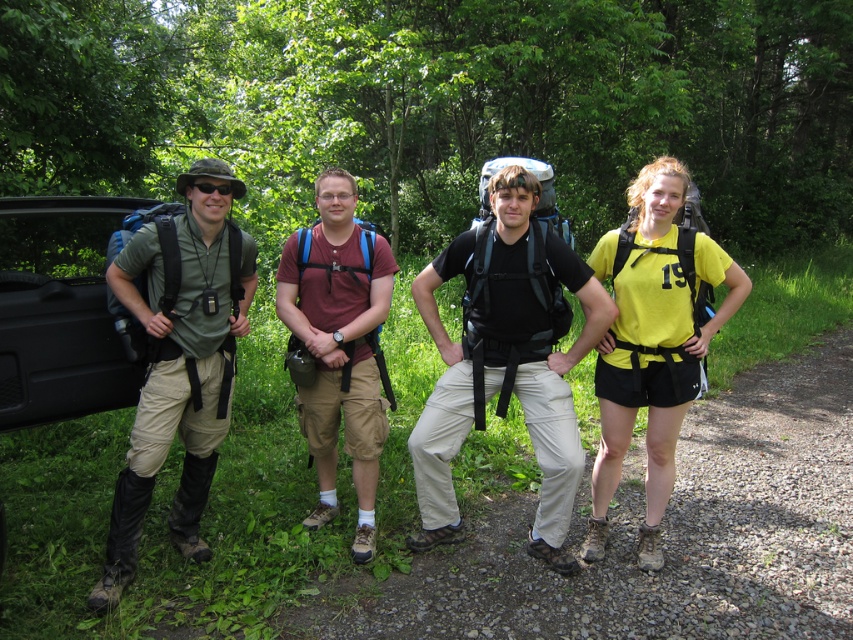
Who is more distant from viewer, (180,520) or (740,301)?

The point (180,520) is behind.

Can you confirm if green matte shirt at left is positioned above yellow matte shirt at right?

No.

Who is more distant from viewer, (x=160, y=248) or (x=656, y=342)?

Point (x=656, y=342)

Where is `green matte shirt at left`? green matte shirt at left is located at coordinates (180, 364).

Can you confirm if green leafy forest at upper center is taller than matte red shirt at center?

Correct, green leafy forest at upper center is much taller as matte red shirt at center.

Is green leafy forest at upper center positioned before matte red shirt at center?

No.

Is point (381, 67) in front of point (357, 344)?

No, (381, 67) is behind (357, 344).

Image resolution: width=853 pixels, height=640 pixels. In order to click on green leafy forest at upper center in this screenshot , I will do `click(439, 104)`.

Who is lower down, matte black backpack at center or matte red shirt at center?

matte black backpack at center is below.

The height and width of the screenshot is (640, 853). What do you see at coordinates (506, 360) in the screenshot?
I see `matte black backpack at center` at bounding box center [506, 360].

Is point (437, 476) closer to camera compared to point (352, 372)?

Yes, it is.

Identify the location of matte black backpack at center. Image resolution: width=853 pixels, height=640 pixels. (506, 360).